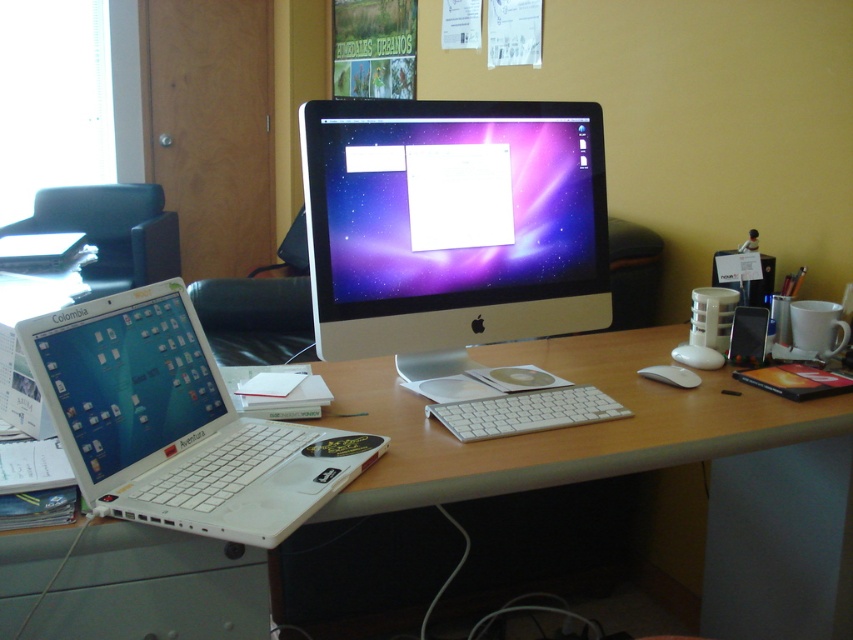
Question: Is white plastic computer desk at center positioned in front of white plastic laptop at lower left?

Choices:
 (A) no
 (B) yes

Answer: (A)

Question: Estimate the real-world distances between objects in this image. Which object is farther from the white plastic laptop at left?

Choices:
 (A) white plastic laptop at lower left
 (B) silver metallic monitor at center
 (C) white matte mouse at center

Answer: (C)

Question: Among these objects, which one is nearest to the camera?

Choices:
 (A) white matte mouse at center
 (B) white plastic laptop at lower left
 (C) silver metallic monitor at center

Answer: (B)

Question: Among these points, which one is nearest to the camera?

Choices:
 (A) (119, 188)
 (B) (71, 234)

Answer: (B)

Question: Is silver metallic monitor at center further to the viewer compared to white plastic keyboard at center?

Choices:
 (A) no
 (B) yes

Answer: (B)

Question: Is white plastic laptop at lower left positioned in front of white plastic keyboard at center?

Choices:
 (A) no
 (B) yes

Answer: (B)